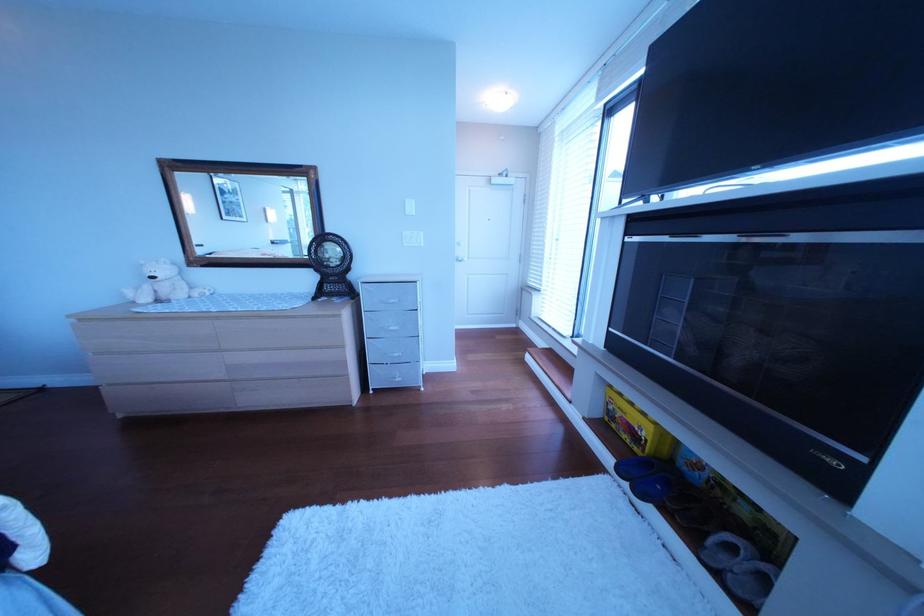
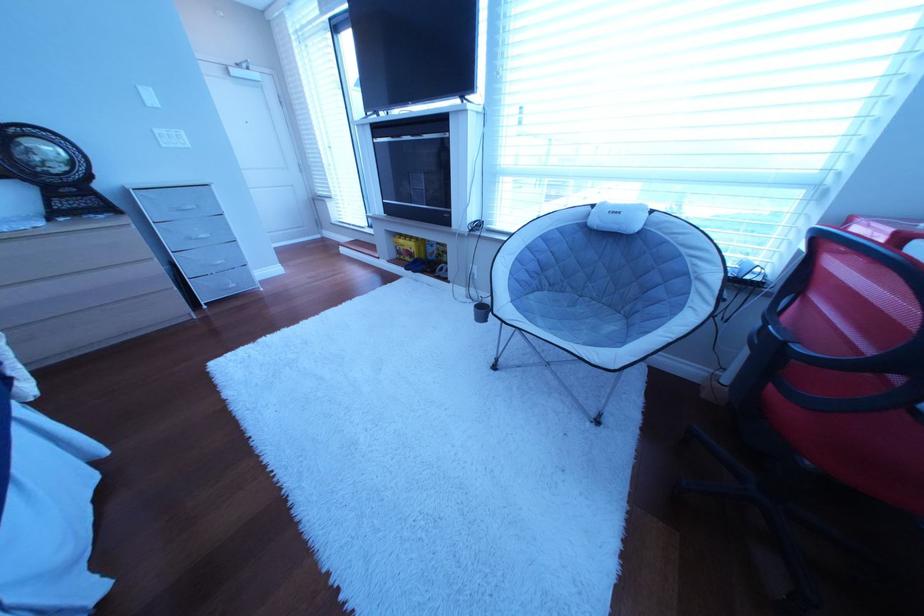
The point at [420,246] is marked in the first image. Where is the corresponding point in the second image?

(179, 148)